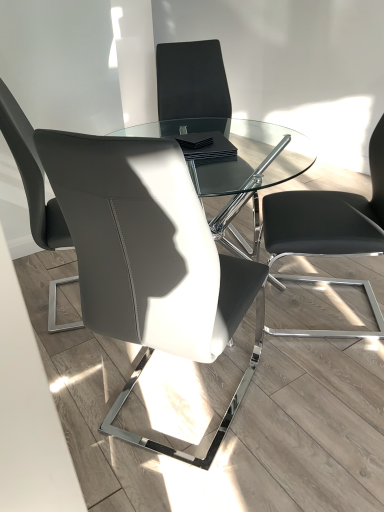
You are a GUI agent. You are given a task and a screenshot of the screen. Output one action in this format:
    pyautogui.click(x=<x>, y=<y>)
    Task: Click on the vacant space that is to the left of matte black chair at center, acting as the 2th chair starting from the left
    Image resolution: width=384 pixels, height=512 pixels.
    Given the screenshot: What is the action you would take?
    pyautogui.click(x=87, y=379)